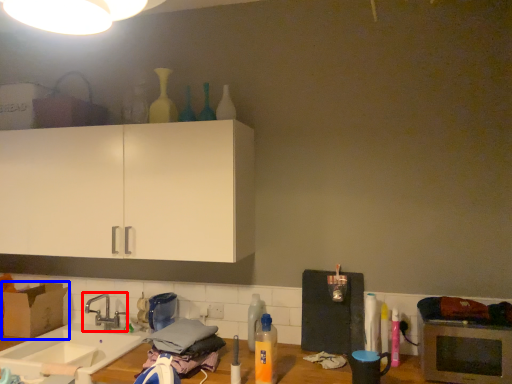
Question: Which object is closer to the camera taking this photo, tap (highlighted by a red box) or cardboard box (highlighted by a blue box)?

Choices:
 (A) tap
 (B) cardboard box

Answer: (A)